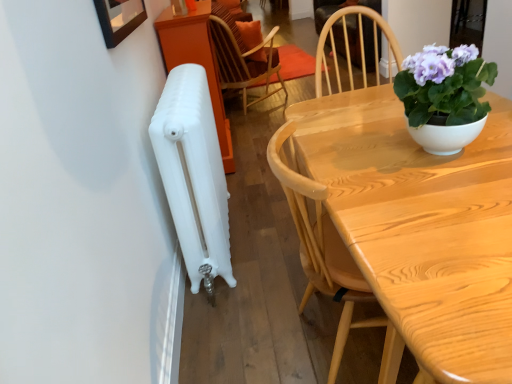
Question: Considering the positions of white matte radiator at left and light wood table at center in the image, is white matte radiator at left wider or thinner than light wood table at center?

Choices:
 (A) thin
 (B) wide

Answer: (A)

Question: Considering the positions of white matte radiator at left and light wood table at center in the image, is white matte radiator at left bigger or smaller than light wood table at center?

Choices:
 (A) big
 (B) small

Answer: (B)

Question: Estimate the real-world distances between objects in this image. Which object is farther from the purple glossy plant at upper right?

Choices:
 (A) white matte radiator at left
 (B) wooden chair at upper center
 (C) light wood table at center

Answer: (B)

Question: Which is farther from the purple glossy plant at upper right?

Choices:
 (A) wooden chair at upper center
 (B) white matte radiator at left
 (C) light wood table at center

Answer: (A)